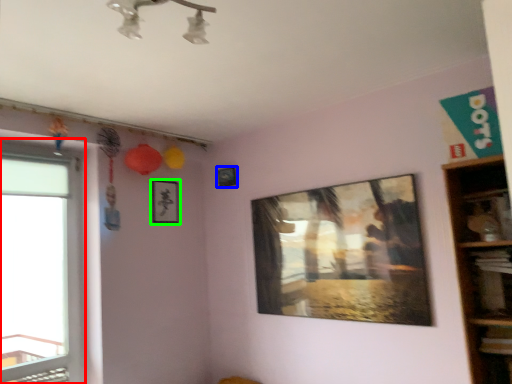
Question: Which object is positioned farthest from window (highlighted by a red box)? Select from picture frame (highlighted by a blue box) and picture frame (highlighted by a green box).

Choices:
 (A) picture frame
 (B) picture frame

Answer: (A)